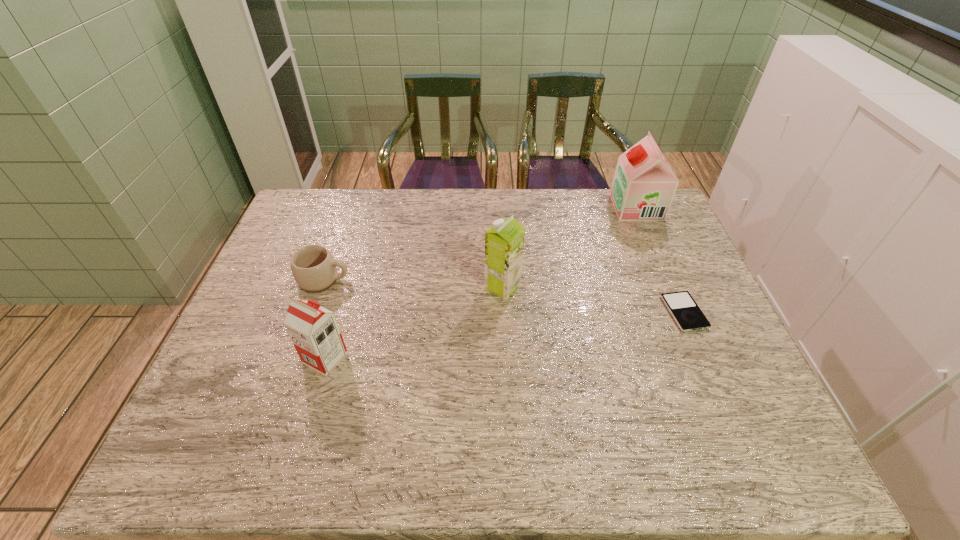
This screenshot has height=540, width=960. In order to click on vacant space that satisfies the following two spatial constraints: 1. on the back side of the shortest object; 2. with the cap open on the farthest soya milk in this screenshot , I will do click(639, 207).

Identify the location of blank space that satisfies the following two spatial constraints: 1. with the cap open on the farthest object; 2. on the front side of the second farthest soya milk. The width and height of the screenshot is (960, 540). (670, 287).

Locate an element on the screen. The image size is (960, 540). free spot that satisfies the following two spatial constraints: 1. on the side of the mug with the handle; 2. on the left side of the shortest object is located at coordinates (312, 313).